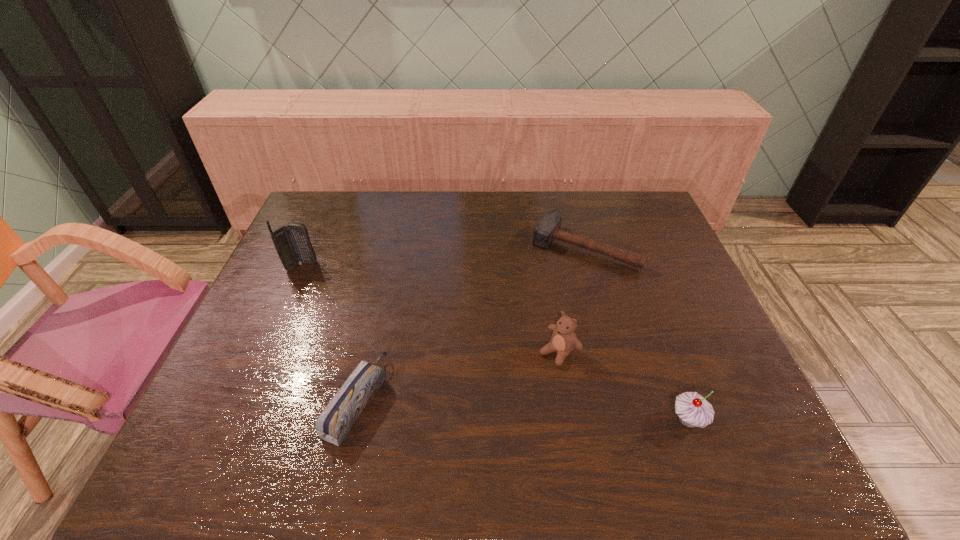
The width and height of the screenshot is (960, 540). Identify the location of pencil box. (335, 422).

Identify the location of cupcake. click(693, 410).

Locate an element on the screen. the shortest object is located at coordinates (548, 229).

Locate an element on the screen. The height and width of the screenshot is (540, 960). teddy bear is located at coordinates (563, 341).

You are a GUI agent. You are given a task and a screenshot of the screen. Output one action in this format:
    pyautogui.click(x=<x>, y=<y>)
    Task: Click on the cellular telephone
    The image size is (960, 540).
    Given the screenshot: What is the action you would take?
    pyautogui.click(x=292, y=243)

Identify the location of the leftmost object. This screenshot has height=540, width=960. (292, 243).

Identify the location of free space located 0.080m on the left of the fourth object from right to left. (294, 400).

Locate an element on the screen. This screenshot has width=960, height=540. blank area located 0.220m on the back of the cupcake is located at coordinates (653, 327).

Image resolution: width=960 pixels, height=540 pixels. Identify the location of vacant space located on the striking surface of the shortest object. (549, 293).

Where is `vacant space located on the striking surface of the shortest object`? This screenshot has height=540, width=960. vacant space located on the striking surface of the shortest object is located at coordinates tap(544, 300).